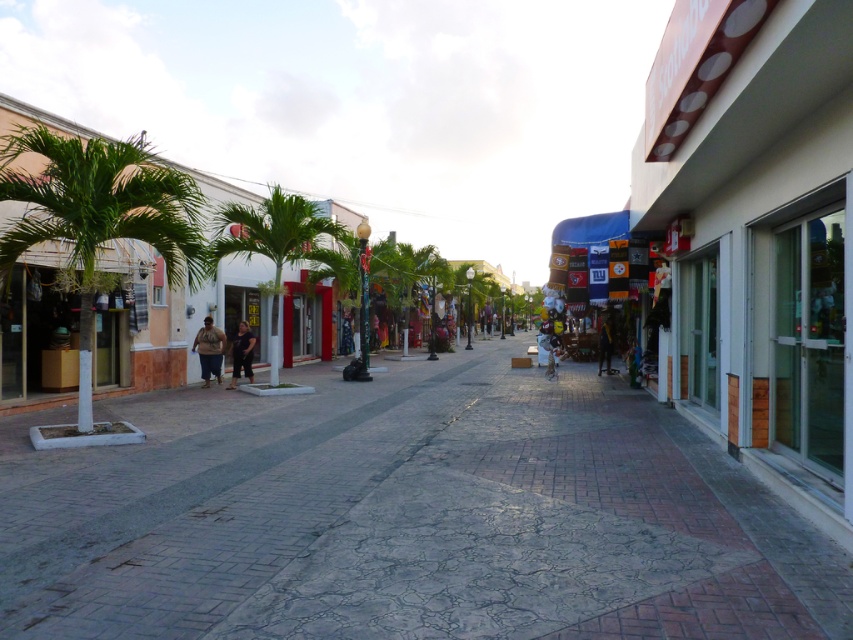
In the scene shown: Is green leafy palm tree at left taller than dark blue jeans at center?

Correct, green leafy palm tree at left is much taller as dark blue jeans at center.

Does green leafy palm tree at left appear on the right side of dark blue jeans at center?

Incorrect, green leafy palm tree at left is not on the right side of dark blue jeans at center.

Is point (62, 138) less distant than point (605, 344)?

Yes, point (62, 138) is closer to viewer.

Find the location of a particular element. Image resolution: width=853 pixels, height=640 pixels. green leafy palm tree at left is located at coordinates (99, 218).

Which of these two, brown fuzzy jacket at center or dark brown leather jacket at center, stands taller?

brown fuzzy jacket at center is taller.

Is point (199, 332) positioned in front of point (242, 362)?

Yes, point (199, 332) is closer to viewer.

The width and height of the screenshot is (853, 640). Find the location of `brown fuzzy jacket at center`. brown fuzzy jacket at center is located at coordinates (209, 349).

Can you confirm if green leafy palm tree at left is smaller than brown fuzzy jacket at center?

No, green leafy palm tree at left is not smaller than brown fuzzy jacket at center.

Does green leafy palm tree at left have a greater width compared to brown fuzzy jacket at center?

Indeed, green leafy palm tree at left has a greater width compared to brown fuzzy jacket at center.

Who is more distant from viewer, (86, 177) or (212, 321)?

The point (212, 321) is more distant.

Find the location of a particular element. The height and width of the screenshot is (640, 853). green leafy palm tree at left is located at coordinates pos(99,218).